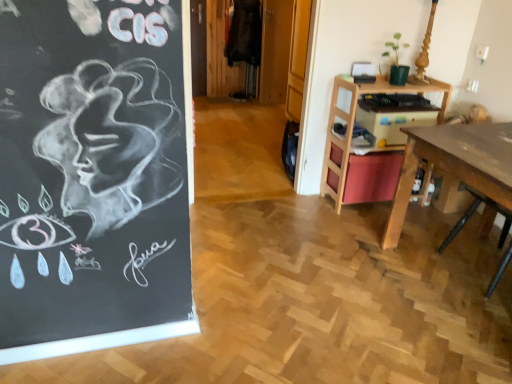
Image resolution: width=512 pixels, height=384 pixels. What are the coordinates of `free space to the left of wooden desk at right` in the screenshot? It's located at (339, 284).